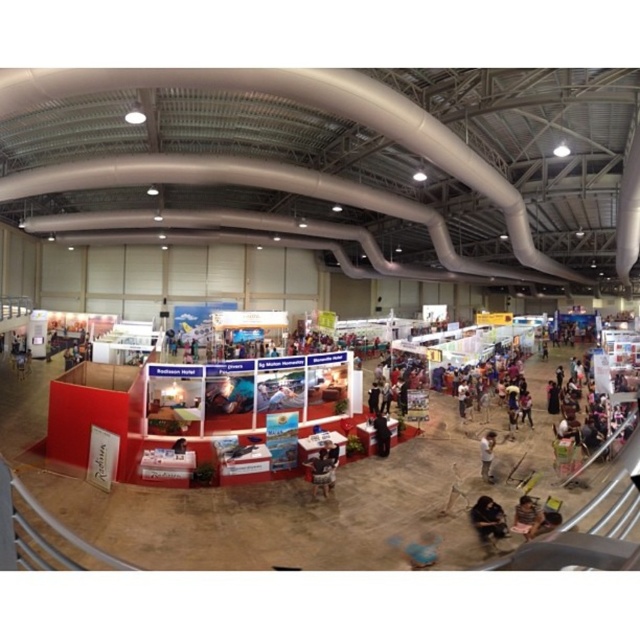
You are a photographer standing in the exhibition hall and want to take a photo of the red booth on the left. You have a camera with a 10 feet focal length. Is the dark fabric bag at lower right in the frame when you focus on the red booth on the left?

The dark fabric bag at lower right is 19.17 feet from the camera. Since the focal length is 10 feet, the bag is outside the camera range and will not be in the frame.

You are standing at the entrance of the exhibition hall and see two points marked in the image. The first point is at coordinate point (x=492, y=516) and the second is at point (x=326, y=477). Which point is closer to you?

Point (x=492, y=516) is closer to the camera than point (x=326, y=477).